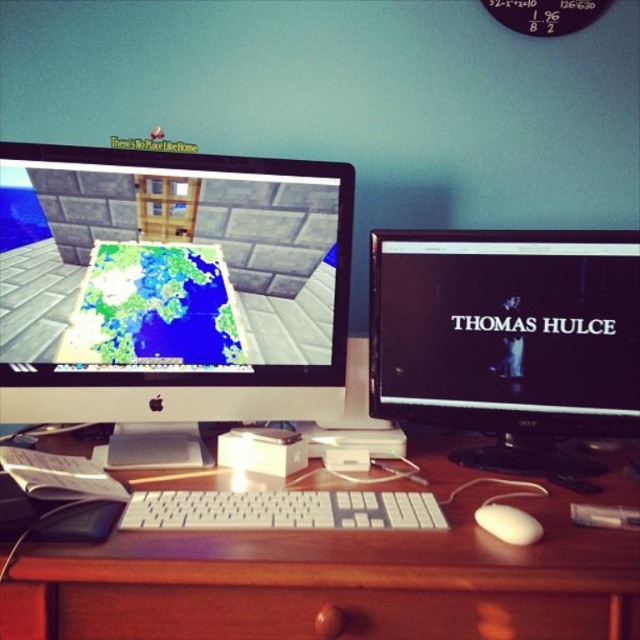
You have a new mouse that is 12 centimeters wide. You want to place it next to the matte black monitor at center and the white plastic keyboard at center. Which object can the mouse fit next to without overlapping?

The matte black monitor at center is wider than the white plastic keyboard at center. Since the mouse is 12 centimeters wide, it can fit next to either object, but it will fit better next to the wider matte black monitor at center to avoid overlapping.

You are a delivery person who needs to place a 12 inch wide package between the wooden desk at center and the black glossy monitor at center. Can you fit it there?

The distance between the wooden desk at center and the black glossy monitor at center is 10.16 inches, which is less than the 12 inch width of the package. Therefore, the package cannot fit in that space.

You are setting up a new webcam for streaming and need to place it on the desk so that it can capture both the matte black monitor at center and the white plastic keyboard at center clearly. Given their sizes, which object should you position the webcam closer to?

The matte black monitor at center is much taller than the white plastic keyboard at center, so positioning the webcam closer to the matte black monitor at center would ensure both objects are captured clearly.